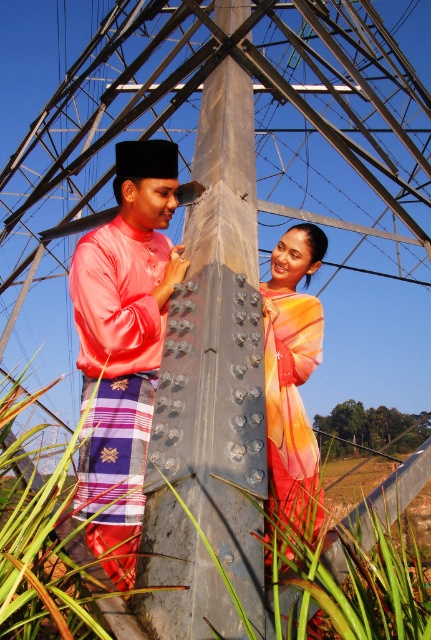
Does metallic gray pole at center appear on the right side of multicolored silk dress at center?

No, metallic gray pole at center is not to the right of multicolored silk dress at center.

Can you confirm if metallic gray pole at center is smaller than multicolored silk dress at center?

No.

Where is `metallic gray pole at center`? metallic gray pole at center is located at coordinates (211, 392).

Where is `metallic gray pole at center`? The width and height of the screenshot is (431, 640). metallic gray pole at center is located at coordinates (211, 392).

Does point (206, 323) come behind point (84, 348)?

No, it is not.

Between metallic gray pole at center and satin pink shirt at center, which one is positioned lower?

satin pink shirt at center is below.

Does point (196, 221) come in front of point (109, 376)?

No.

The height and width of the screenshot is (640, 431). I want to click on metallic gray pole at center, so click(x=211, y=392).

Who is more distant from viewer, (x=111, y=234) or (x=271, y=417)?

The point (x=111, y=234) is more distant.

Who is positioned more to the right, silky pink shirt at center or multicolored silk dress at center?

From the viewer's perspective, multicolored silk dress at center appears more on the right side.

Where is `silky pink shirt at center`? This screenshot has width=431, height=640. silky pink shirt at center is located at coordinates (124, 346).

I want to click on silky pink shirt at center, so click(x=124, y=346).